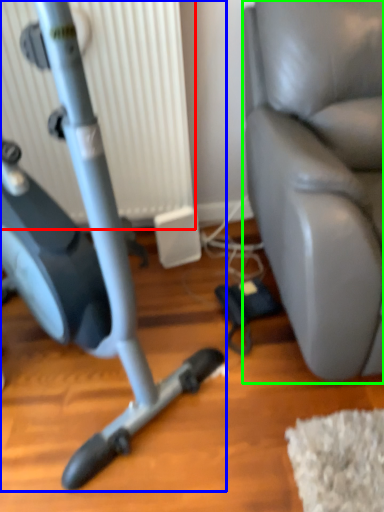
Question: Based on their relative distances, which object is nearer to radiator (highlighted by a red box)? Choose from stationary bicycle (highlighted by a blue box) and swivel chair (highlighted by a green box).

Choices:
 (A) stationary bicycle
 (B) swivel chair

Answer: (B)